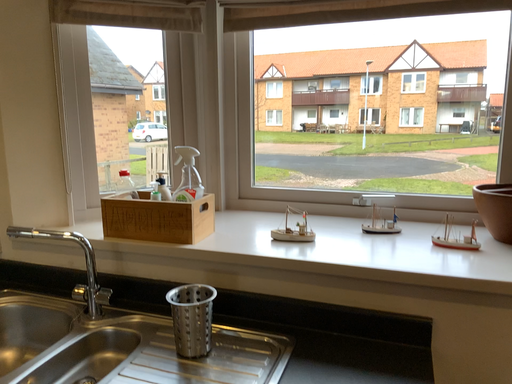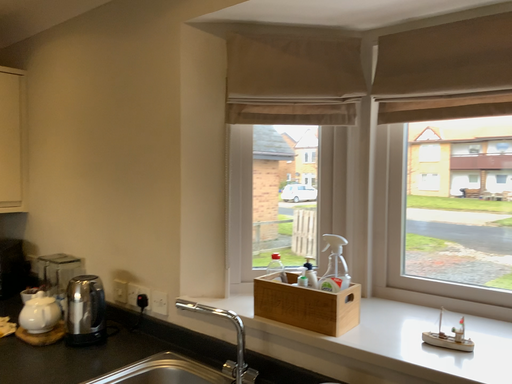
Question: How did the camera likely rotate when shooting the video?

Choices:
 (A) rotated downward
 (B) rotated upward

Answer: (B)